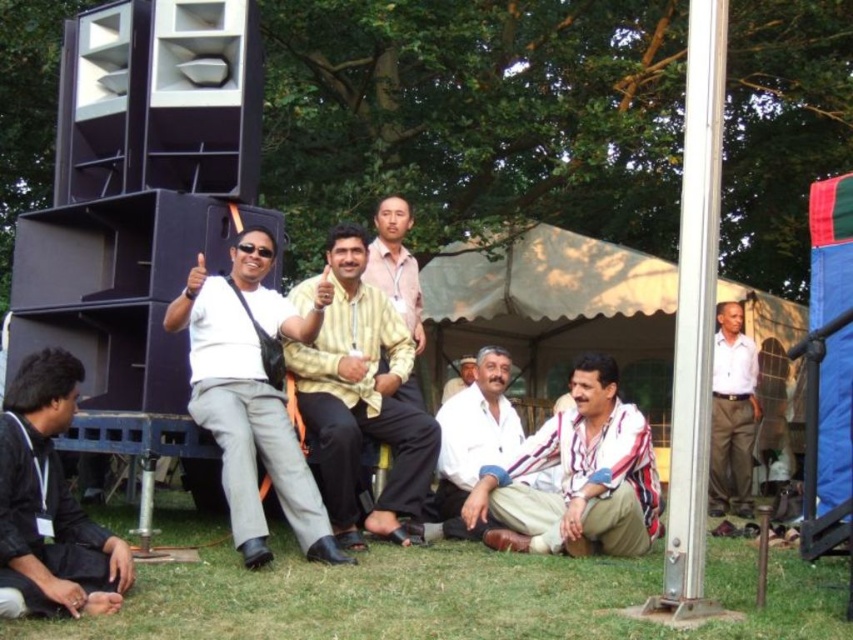
You are a photographer setting up for a group photo. You have two men in white shirts in the frame. One is wearing a white matte shirt at center and the other a white cotton shirt at right. Based on their positions, which shirt might appear wider in the photo?

The white matte shirt at center might appear wider than the white cotton shirt at right according to the description.

You are standing in the park where the group is gathered. You see a point at coordinates point (50, 500). Can you tell me which object this point is located on?

The point (50, 500) is located on the black matte jacket at lower left.

You are standing in the park and see two points marked in the image. Which point is closer to you, point [630,428] or point [474,528]?

Point [630,428] is closer to the viewer than point [474,528].